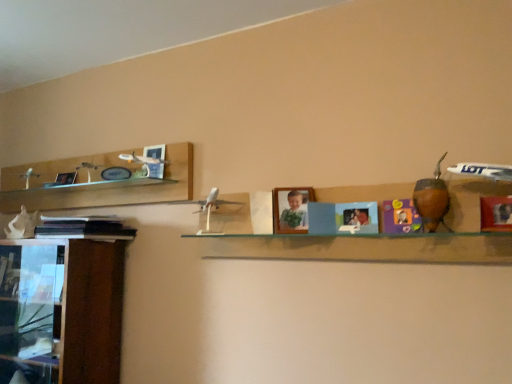
Question: From a real-world perspective, is matte purple toy at center, which appears as the 2th toy when viewed from the front, above or below black matte book at left?

Choices:
 (A) above
 (B) below

Answer: (A)

Question: In the image, is matte purple toy at center, the 2th toy positioned from the left, positioned in front of or behind black matte book at left?

Choices:
 (A) behind
 (B) front

Answer: (B)

Question: Which is nearer to the matte purple toy at center, the 2th toy positioned from the left?

Choices:
 (A) wooden cabinet at left
 (B) brown leather gourd at right, placed as the first toy when sorted from front to back
 (C) white matte seashell at left, the third toy viewed from the front
 (D) black matte book at left
 (E) clear glass shelf at center

Answer: (B)

Question: Estimate the real-world distances between objects in this image. Which object is farther from the matte purple toy at center, the 2th toy positioned from the left?

Choices:
 (A) white matte seashell at left, marked as the first toy in a back-to-front arrangement
 (B) wooden cabinet at left
 (C) black matte book at left
 (D) clear glass shelf at center
 (E) brown leather gourd at right, marked as the 3th toy in a left-to-right arrangement

Answer: (A)